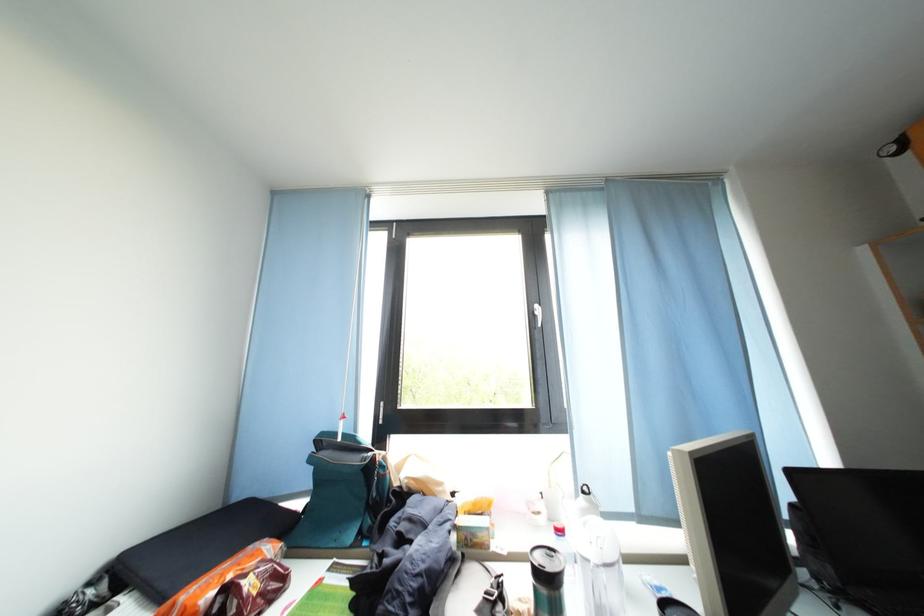
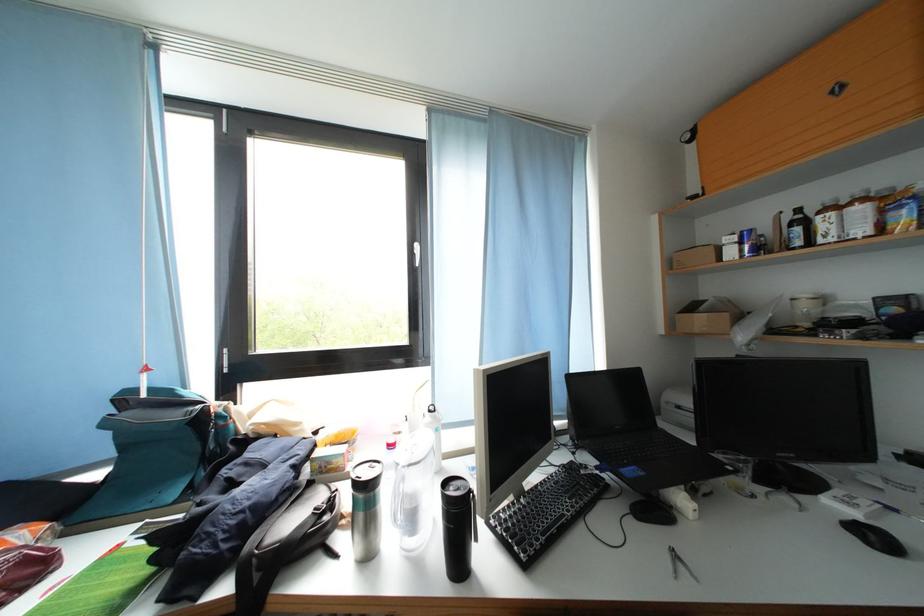
Locate, in the second image, the point that corresponds to [568,537] in the first image.

(398, 451)